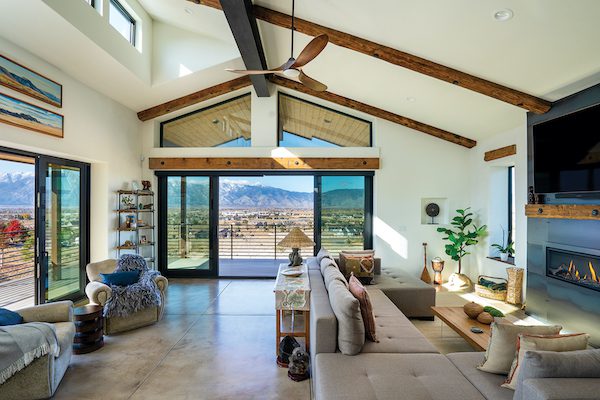
Locate an element on the screen. Image resolution: width=600 pixels, height=400 pixels. lamp in the background middle is located at coordinates (293, 255).